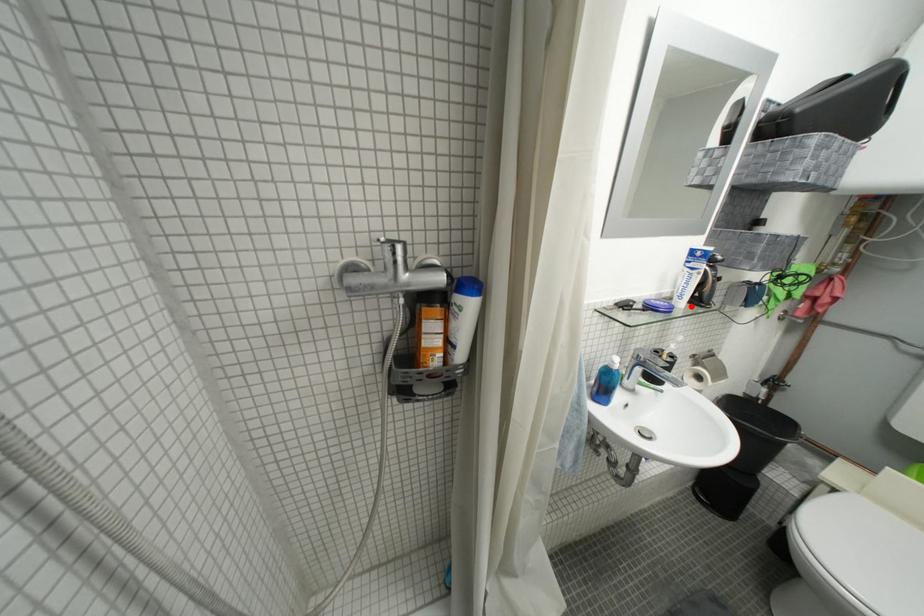
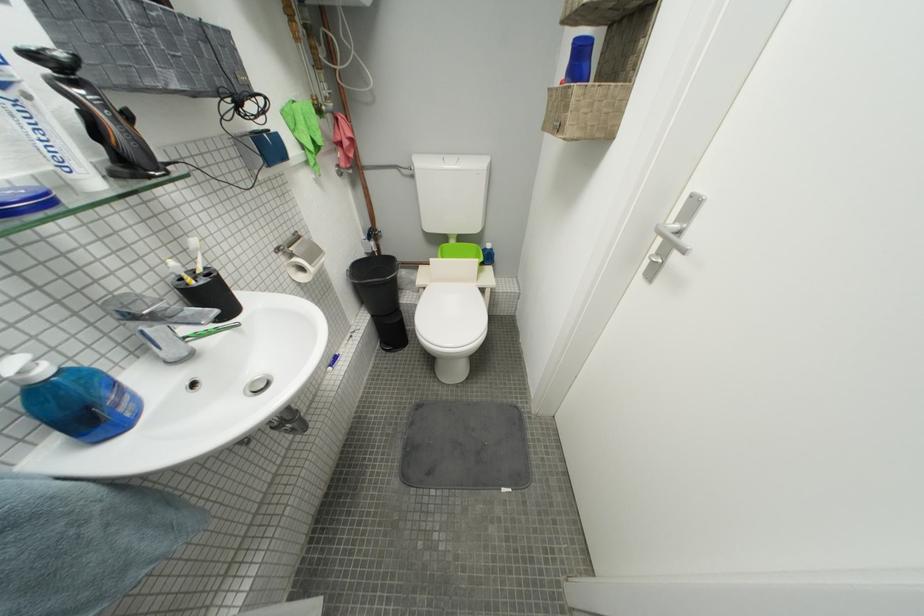
Where in the second image is the point corresponding to the highlighted location from the first image?

(103, 185)